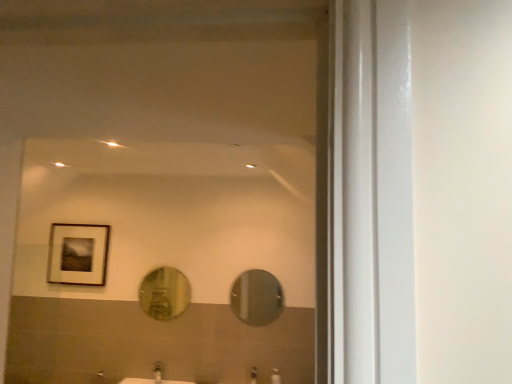
Question: Considering the relative sizes of gold textured mirror at center, positioned as the 1th mirror in left-to-right order, and matte silver faucet at lower center, the second faucet when ordered from right to left, in the image provided, is gold textured mirror at center, positioned as the 1th mirror in left-to-right order, smaller than matte silver faucet at lower center, the second faucet when ordered from right to left,?

Choices:
 (A) yes
 (B) no

Answer: (B)

Question: Can you confirm if gold textured mirror at center, the 2th mirror in the right-to-left sequence, is positioned to the right of matte silver faucet at lower center, the 1th faucet from the left?

Choices:
 (A) no
 (B) yes

Answer: (B)

Question: Can you confirm if gold textured mirror at center, the 2th mirror in the right-to-left sequence, is bigger than matte silver faucet at lower center, the second faucet when ordered from right to left?

Choices:
 (A) no
 (B) yes

Answer: (B)

Question: Does gold textured mirror at center, the 2th mirror in the right-to-left sequence, come behind matte silver faucet at lower center, the 1th faucet from the left?

Choices:
 (A) no
 (B) yes

Answer: (B)

Question: Can you confirm if gold textured mirror at center, positioned as the 1th mirror in left-to-right order, is taller than matte silver faucet at lower center, the second faucet when ordered from right to left?

Choices:
 (A) no
 (B) yes

Answer: (B)

Question: From a real-world perspective, is gold textured mirror at center, the 2th mirror in the right-to-left sequence, positioned above or below matte silver faucet at lower center, positioned as the 2th faucet in left-to-right order?

Choices:
 (A) below
 (B) above

Answer: (B)

Question: In the image, is gold textured mirror at center, positioned as the 1th mirror in left-to-right order, on the left side or the right side of matte silver faucet at lower center, positioned as the 2th faucet in left-to-right order?

Choices:
 (A) left
 (B) right

Answer: (A)

Question: Considering the positions of gold textured mirror at center, positioned as the 1th mirror in left-to-right order, and matte silver faucet at lower center, the 1th faucet in the right-to-left sequence, in the image, is gold textured mirror at center, positioned as the 1th mirror in left-to-right order, taller or shorter than matte silver faucet at lower center, the 1th faucet in the right-to-left sequence,?

Choices:
 (A) short
 (B) tall

Answer: (B)

Question: Do you think gold textured mirror at center, the 2th mirror in the right-to-left sequence, is within matte silver faucet at lower center, the 1th faucet in the right-to-left sequence, or outside of it?

Choices:
 (A) inside
 (B) outside

Answer: (B)

Question: Would you say matte silver faucet at lower center, positioned as the 2th faucet in left-to-right order, is to the left or to the right of matte silver faucet at lower center, the second faucet when ordered from right to left, in the picture?

Choices:
 (A) left
 (B) right

Answer: (B)

Question: Would you say matte silver faucet at lower center, positioned as the 2th faucet in left-to-right order, is inside or outside matte silver faucet at lower center, the 1th faucet from the left?

Choices:
 (A) inside
 (B) outside

Answer: (B)

Question: Is matte silver faucet at lower center, positioned as the 2th faucet in left-to-right order, in front of or behind matte silver faucet at lower center, the 1th faucet from the left, in the image?

Choices:
 (A) behind
 (B) front

Answer: (B)

Question: From their relative heights in the image, would you say matte silver faucet at lower center, positioned as the 2th faucet in left-to-right order, is taller or shorter than matte silver faucet at lower center, the second faucet when ordered from right to left?

Choices:
 (A) short
 (B) tall

Answer: (B)

Question: Is shiny metallic mirror at center, arranged as the first mirror when viewed from the right, wider or thinner than gold textured mirror at center, positioned as the 1th mirror in left-to-right order?

Choices:
 (A) thin
 (B) wide

Answer: (A)

Question: From a real-world perspective, is shiny metallic mirror at center, the second mirror when ordered from left to right, positioned above or below gold textured mirror at center, positioned as the 1th mirror in left-to-right order?

Choices:
 (A) above
 (B) below

Answer: (B)